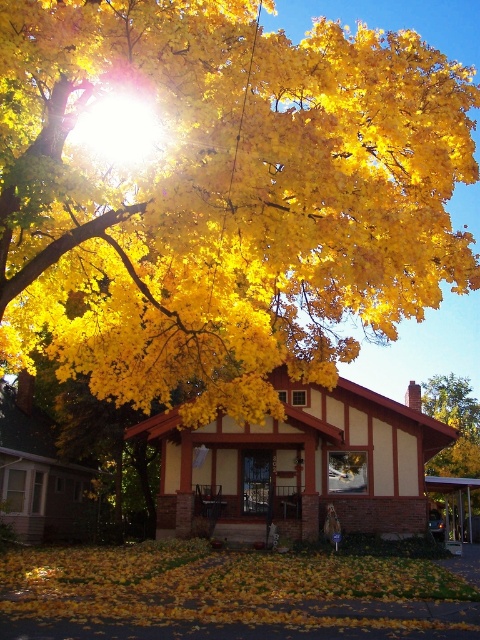
You are standing in front of the house and notice the golden yellow leaves at upper center and the yellow matte tree at center. Which object is nearer to you?

The golden yellow leaves at upper center are closer to the viewer than the yellow matte tree at center.

You are standing in front of the house at number 802 and want to place a small birdhouse. The birdhouse needs to be placed above the yellow dry leaves at lower center but below the golden yellow leaves at upper center. Is this possible?

The golden yellow leaves at upper center has a greater height compared to yellow dry leaves at lower center, so yes, placing the birdhouse between them is possible as there is vertical space between the two leaf groups.